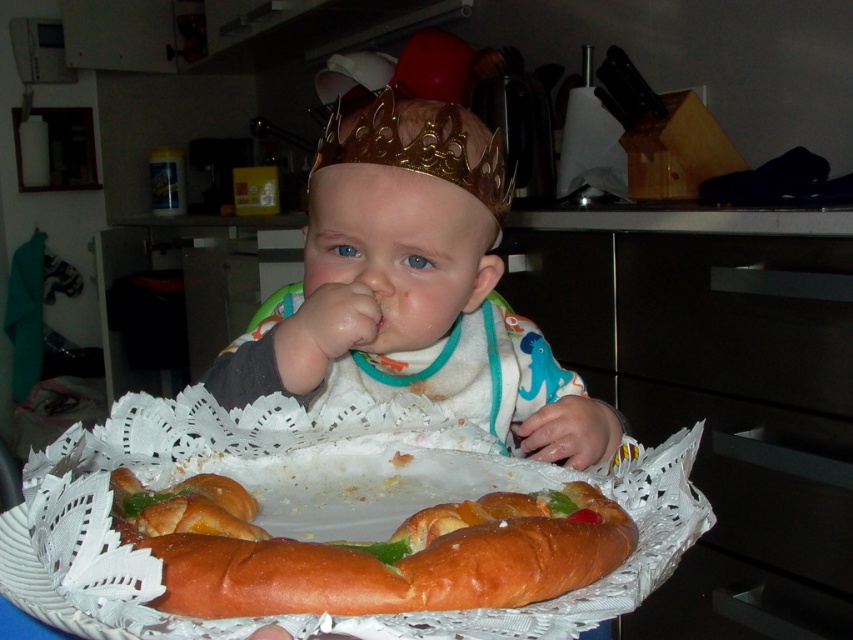
The baby is sitting at the table wearing a gold shiny crown at center and looking at the golden bread ring at center. Which object is located above the other?

The gold shiny crown at center is positioned over golden bread ring at center, meaning it is above the bread ring.